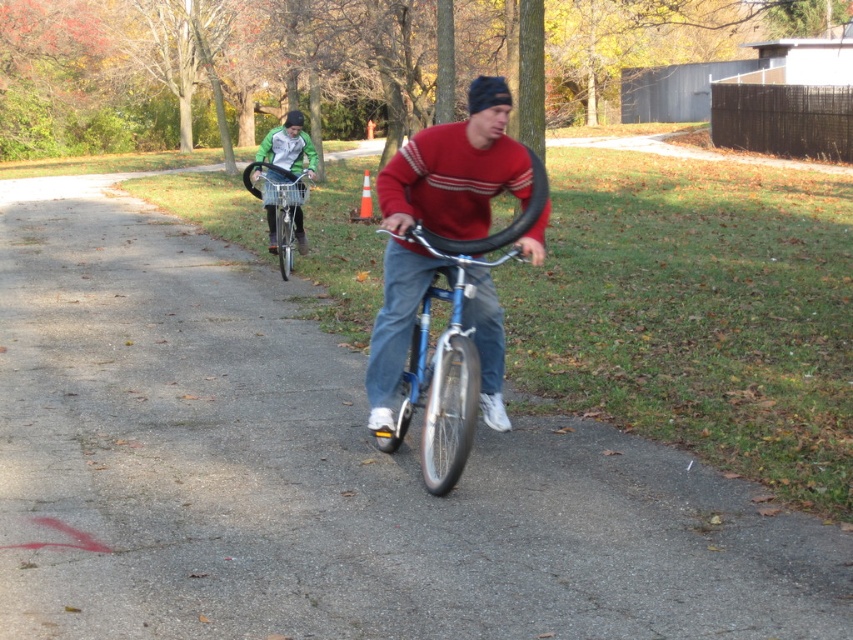
You are standing on the path and see two points marked in the image. Which point is closer to you, point (402, 148) or point (302, 156)?

Point (402, 148) is closer to the viewer than point (302, 156).

You are a photographer standing on the path. You want to take a photo of the matte red sweater at center and the matte black bicycle at center. Based on their positions, which object should you focus on first to ensure both are in the frame?

The matte red sweater at center is located below the matte black bicycle at center, so you should focus on the matte black bicycle at center first to ensure both are in the frame.

Based on the photo, you are a photographer standing on the path. You want to take a photo of the blue metallic bicycle at center and the matte red sweater at center. Which object should you focus on first if you want to capture both in sharp focus?

The blue metallic bicycle at center is located below the matte red sweater at center. To capture both in sharp focus, you should focus on the matte red sweater at center first since it is closer to the camera, and the bicycle will be in the background depth of field.